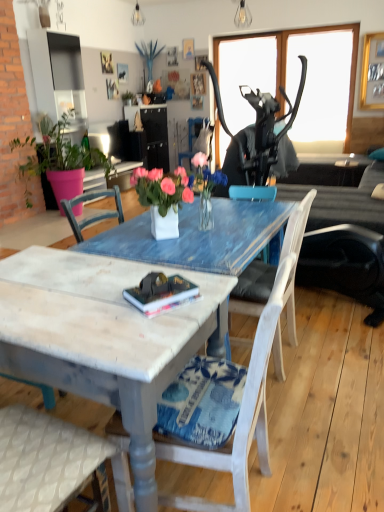
Locate an element on the screen. free space above hardcover book at center (from a real-world perspective) is located at coordinates (170, 291).